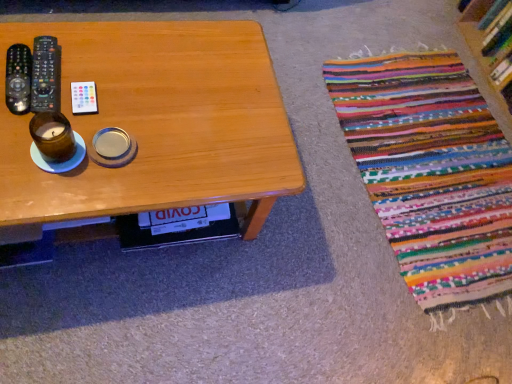
The image size is (512, 384). I want to click on vacant area that is in front of multicolored woven rug at lower right, so click(324, 301).